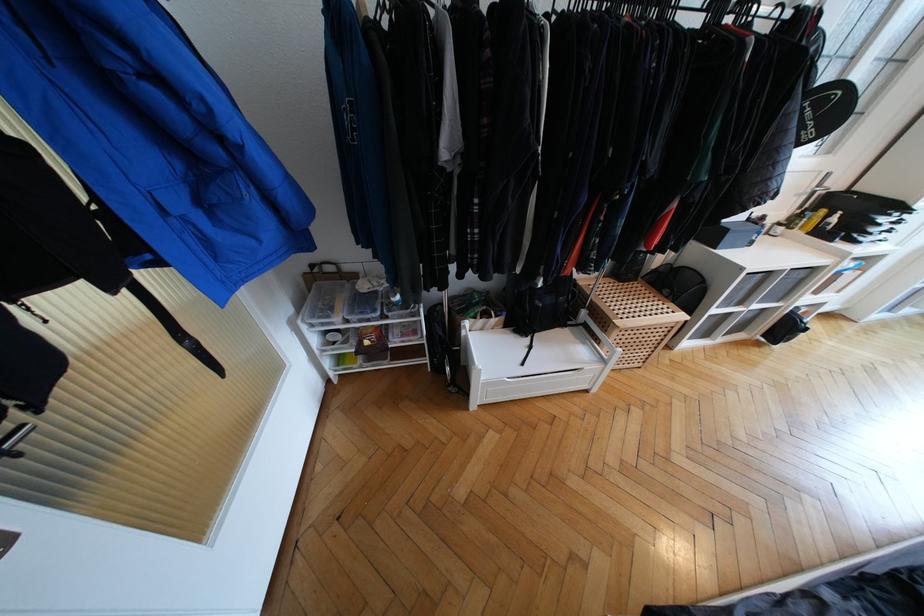
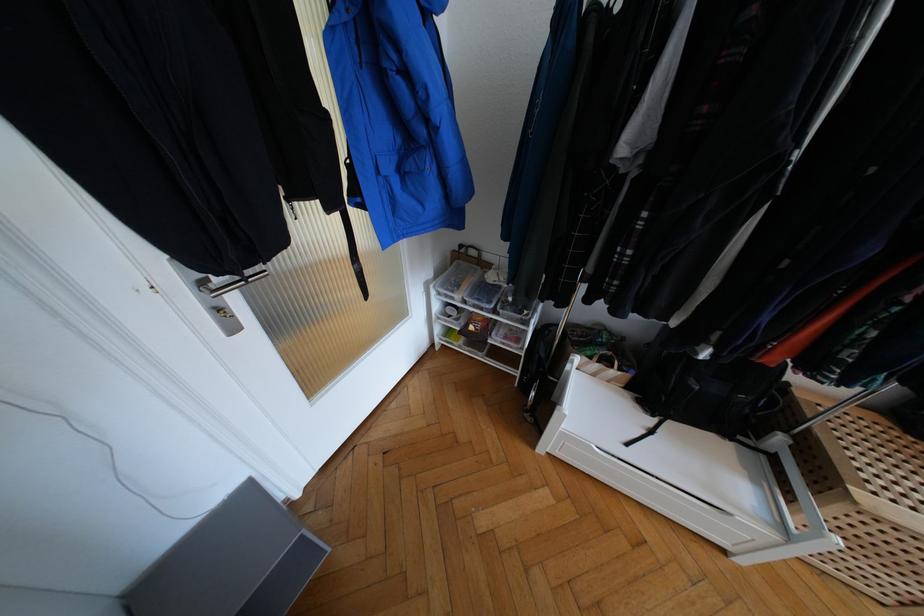
Question: The camera is either moving clockwise (left) or counter-clockwise (right) around the object. The first image is from the beginning of the video and the second image is from the end. Is the camera moving left or right when shooting the video?

Choices:
 (A) Left
 (B) Right

Answer: (B)